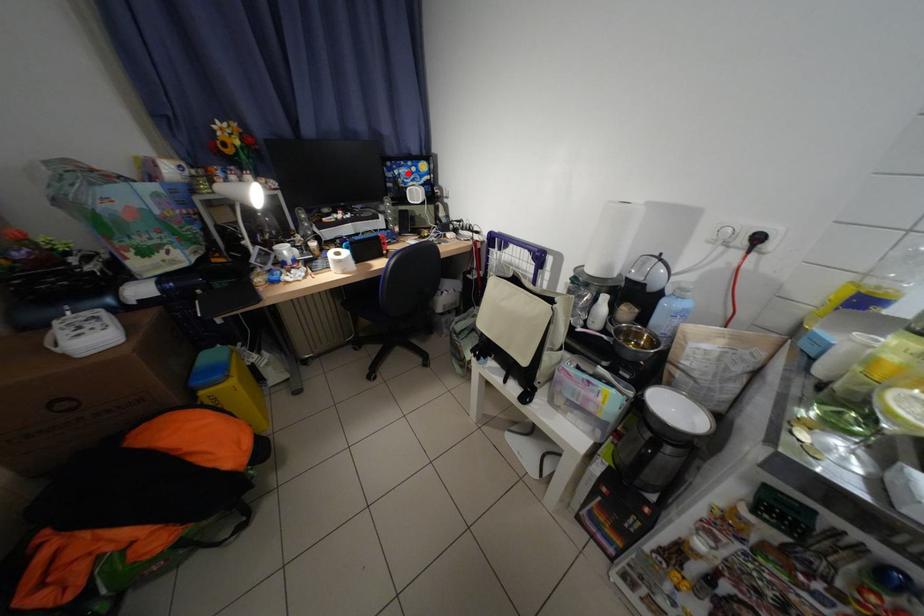
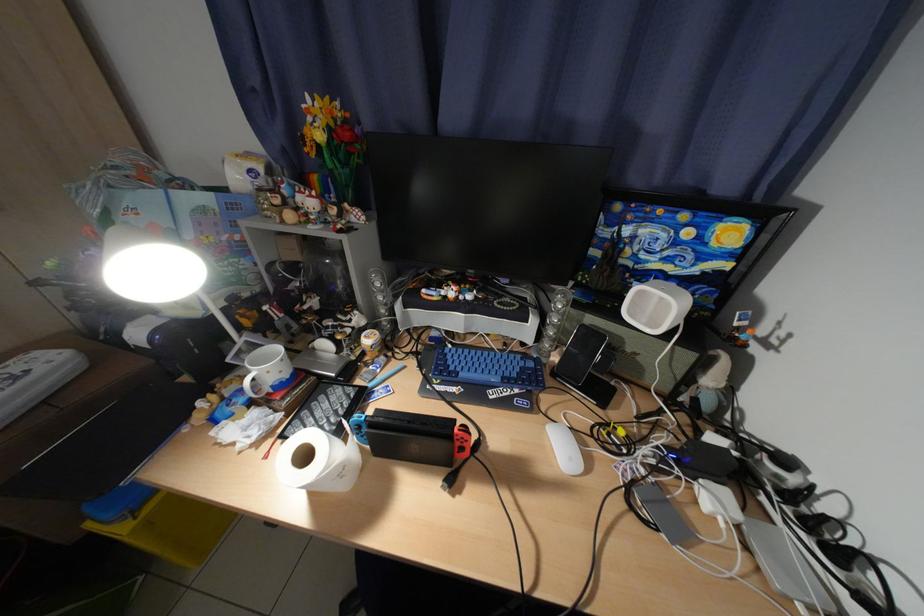
Find the pixel in the second image that matches the highlighted location in the first image.

(638, 233)